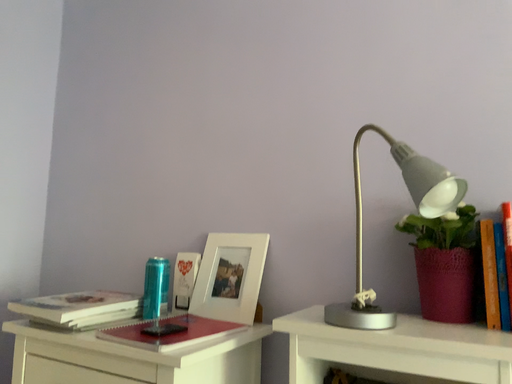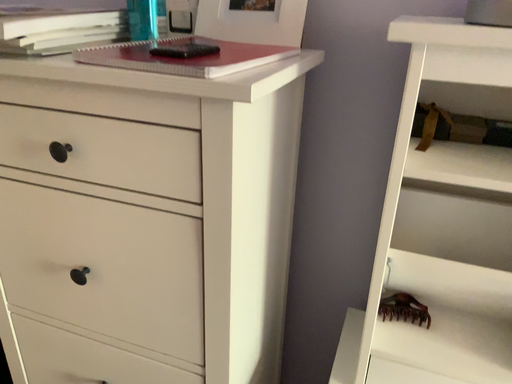
Question: Which way did the camera rotate in the video?

Choices:
 (A) rotated left
 (B) rotated right

Answer: (B)